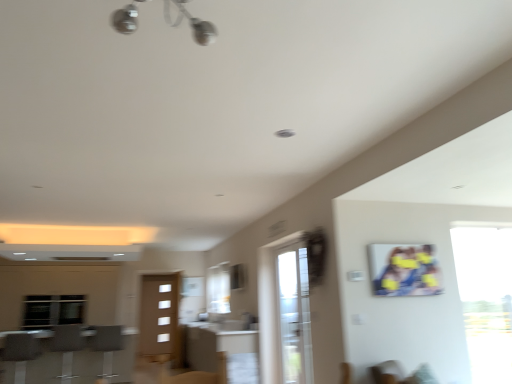
Question: Can you confirm if metallic chrome light fixture at upper center is shorter than clear glass screen door at center?

Choices:
 (A) no
 (B) yes

Answer: (B)

Question: Does metallic chrome light fixture at upper center have a larger size compared to clear glass screen door at center?

Choices:
 (A) yes
 (B) no

Answer: (B)

Question: Does metallic chrome light fixture at upper center have a greater height compared to clear glass screen door at center?

Choices:
 (A) yes
 (B) no

Answer: (B)

Question: Is metallic chrome light fixture at upper center positioned with its back to clear glass screen door at center?

Choices:
 (A) no
 (B) yes

Answer: (A)

Question: Could you tell me if metallic chrome light fixture at upper center is facing clear glass screen door at center?

Choices:
 (A) yes
 (B) no

Answer: (B)

Question: From a real-world perspective, is metallic chrome light fixture at upper center on clear glass screen door at center?

Choices:
 (A) no
 (B) yes

Answer: (B)

Question: Is metallic silver barstools at lower left taller than transparent glass window at right?

Choices:
 (A) no
 (B) yes

Answer: (A)

Question: Considering the relative sizes of metallic silver barstools at lower left and transparent glass window at right in the image provided, is metallic silver barstools at lower left bigger than transparent glass window at right?

Choices:
 (A) yes
 (B) no

Answer: (A)

Question: Is metallic silver barstools at lower left shorter than transparent glass window at right?

Choices:
 (A) yes
 (B) no

Answer: (A)

Question: Considering the relative positions of metallic silver barstools at lower left and transparent glass window at right in the image provided, is metallic silver barstools at lower left to the left of transparent glass window at right from the viewer's perspective?

Choices:
 (A) yes
 (B) no

Answer: (A)

Question: Is transparent glass window at right a part of metallic silver barstools at lower left?

Choices:
 (A) no
 (B) yes

Answer: (A)

Question: Is metallic silver barstools at lower left at the right side of transparent glass window at right?

Choices:
 (A) no
 (B) yes

Answer: (A)

Question: Is transparent glass window at right placed right next to clear glass screen door at center?

Choices:
 (A) no
 (B) yes

Answer: (A)